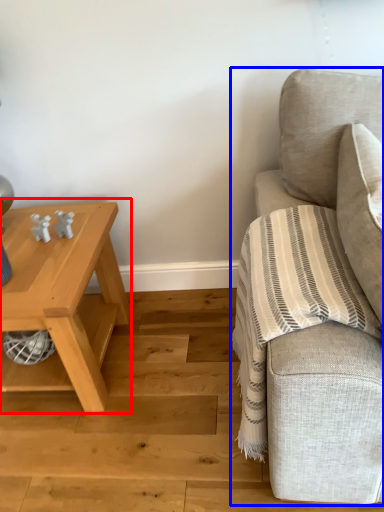
Question: Among these objects, which one is nearest to the camera, table (highlighted by a red box) or studio couch (highlighted by a blue box)?

Choices:
 (A) table
 (B) studio couch

Answer: (B)